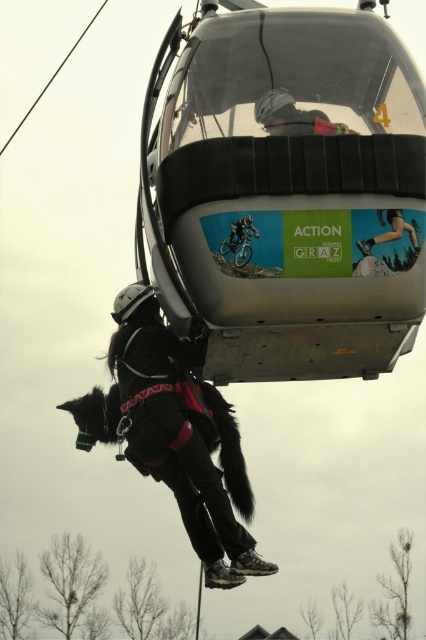
Question: Which of the following is the farthest from the observer?

Choices:
 (A) silver metallic cable car at upper center
 (B) smooth skin at center
 (C) dark gray fabric jacket at upper center
 (D) black matte/soft material jacket at lower center

Answer: (D)

Question: Among these points, which one is nearest to the camera?

Choices:
 (A) (261, 99)
 (B) (360, 244)
 (C) (190, 504)
 (D) (207, 163)

Answer: (B)

Question: Can you confirm if black matte/soft material jacket at lower center is positioned to the left of smooth skin at center?

Choices:
 (A) yes
 (B) no

Answer: (A)

Question: Estimate the real-world distances between objects in this image. Which object is closer to the smooth skin at center?

Choices:
 (A) black matte/soft material jacket at lower center
 (B) silver metallic cable car at upper center
 (C) dark gray fabric jacket at upper center

Answer: (C)

Question: Does black matte/soft material jacket at lower center have a lesser width compared to dark gray fabric jacket at upper center?

Choices:
 (A) yes
 (B) no

Answer: (B)

Question: In this image, where is black matte/soft material jacket at lower center located relative to dark gray fabric jacket at upper center?

Choices:
 (A) above
 (B) below

Answer: (B)